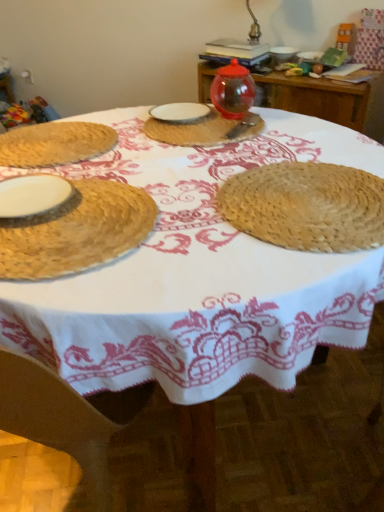
Locate an element on the screen. vacant space that is in between woven straw placemat at left, arranged as the 1th table when viewed from the front, and natural straw placemat at center is located at coordinates (170, 163).